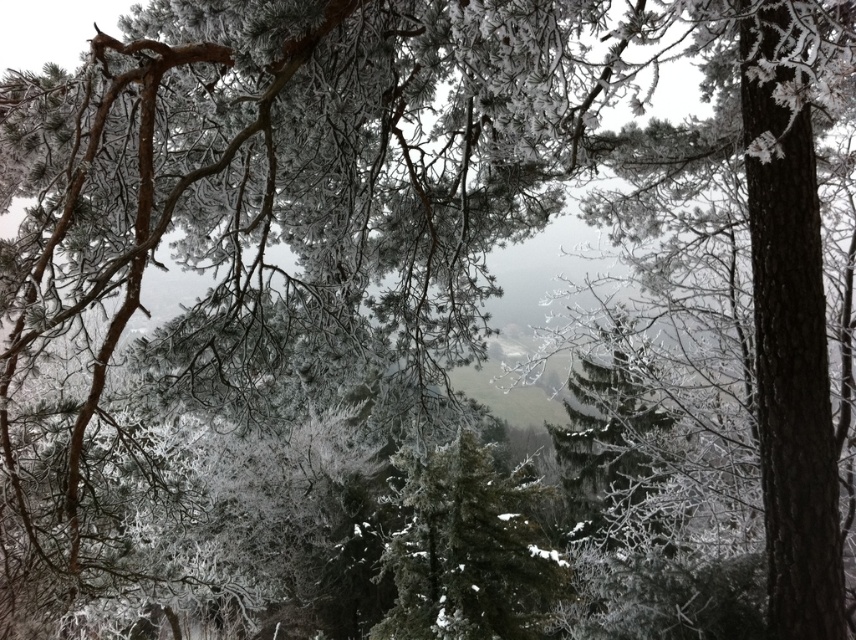
Question: Which of the following is the farthest from the observer?

Choices:
 (A) green matte tree at center
 (B) frosted pine tree at center

Answer: (A)

Question: Observing the image, what is the correct spatial positioning of green matte tree at center in reference to frosted pine tree at center?

Choices:
 (A) left
 (B) right

Answer: (A)

Question: Does green matte tree at center appear on the right side of frosted pine tree at center?

Choices:
 (A) no
 (B) yes

Answer: (A)

Question: Can you confirm if green matte tree at center is positioned to the left of frosted pine tree at center?

Choices:
 (A) no
 (B) yes

Answer: (B)